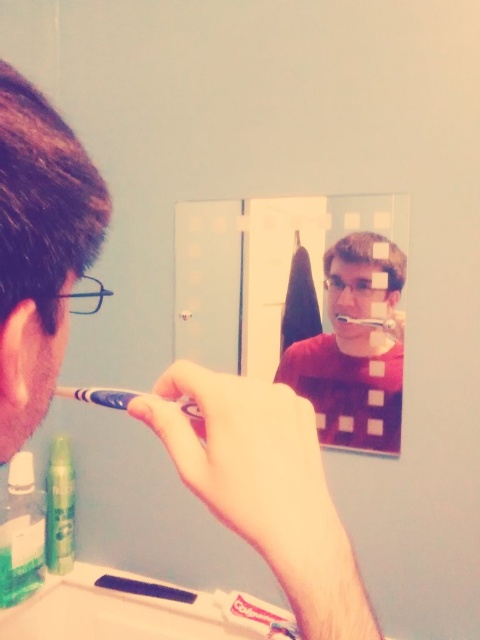
Can you confirm if blue plastic toothbrush at center is thinner than white plastic toothbrush at center?

No, blue plastic toothbrush at center is not thinner than white plastic toothbrush at center.

What are the coordinates of `blue plastic toothbrush at center` in the screenshot? It's located at (98, 396).

Does point (123, 401) come farther from viewer compared to point (342, 321)?

No, (123, 401) is closer to viewer.

The image size is (480, 640). Find the location of `blue plastic toothbrush at center`. blue plastic toothbrush at center is located at coordinates (98, 396).

Can you confirm if white matte toothpaste at lower center is positioned to the right of blue plastic toothbrush at center?

Yes, white matte toothpaste at lower center is to the right of blue plastic toothbrush at center.

Between point (251, 618) and point (78, 394), which one is positioned behind?

The point (251, 618) is more distant.

Who is more forward, (264,624) or (109,406)?

Positioned in front is point (109,406).

Identify the location of white matte toothpaste at lower center. Image resolution: width=480 pixels, height=640 pixels. (255, 616).

Based on the photo, does matte plastic toothbrush at center have a smaller size compared to green matte spray can at lower left?

Incorrect, matte plastic toothbrush at center is not smaller in size than green matte spray can at lower left.

Does point (358, 355) lie in front of point (0, 547)?

That is True.

Describe the element at coordinates (354, 349) in the screenshot. I see `matte plastic toothbrush at center` at that location.

This screenshot has width=480, height=640. In order to click on matte plastic toothbrush at center in this screenshot , I will do `click(354, 349)`.